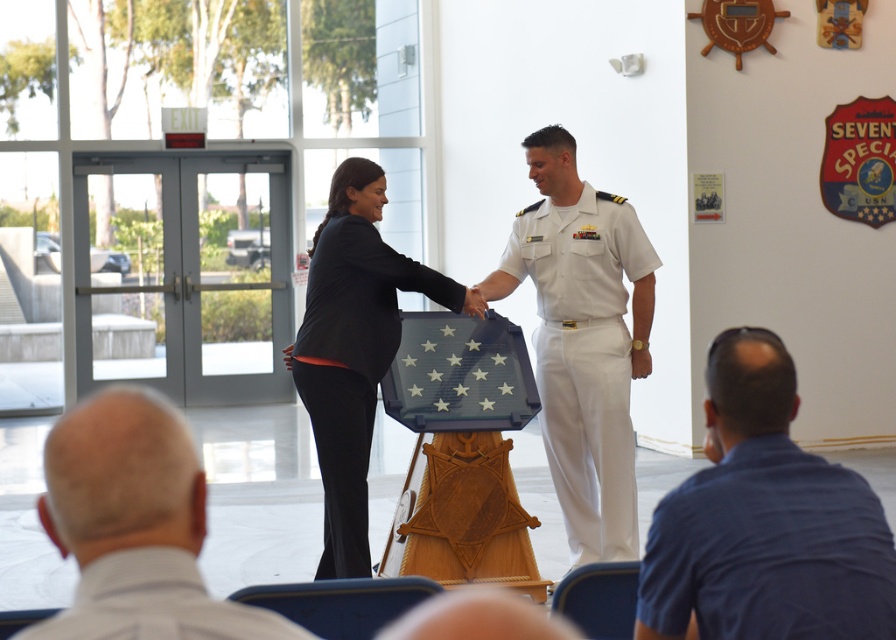
Which is behind, point (599, 476) or point (93, 584)?

The point (599, 476) is more distant.

Which is more to the left, white cotton uniform at center or khaki fabric uniform at lower left?

khaki fabric uniform at lower left is more to the left.

Is point (556, 424) farther from camera compared to point (212, 609)?

Yes, it is.

Where is `white cotton uniform at center`? The width and height of the screenshot is (896, 640). white cotton uniform at center is located at coordinates (584, 358).

Can you confirm if blue shirt at lower right is positioned below white shirt at lower left?

Yes.

In the scene shown: Is blue shirt at lower right thinner than white shirt at lower left?

No, blue shirt at lower right is not thinner than white shirt at lower left.

Measure the distance between point (x=711, y=497) and camera.

They are 3.52 meters apart.

Where is `blue shirt at lower right`? blue shirt at lower right is located at coordinates (765, 522).

How distant is black fabric suit at center from khaki fabric uniform at lower left?

black fabric suit at center and khaki fabric uniform at lower left are 5.03 meters apart.

How far apart are black fabric suit at center and khaki fabric uniform at lower left?

The distance of black fabric suit at center from khaki fabric uniform at lower left is 16.50 feet.

Locate an element on the screen. black fabric suit at center is located at coordinates (354, 348).